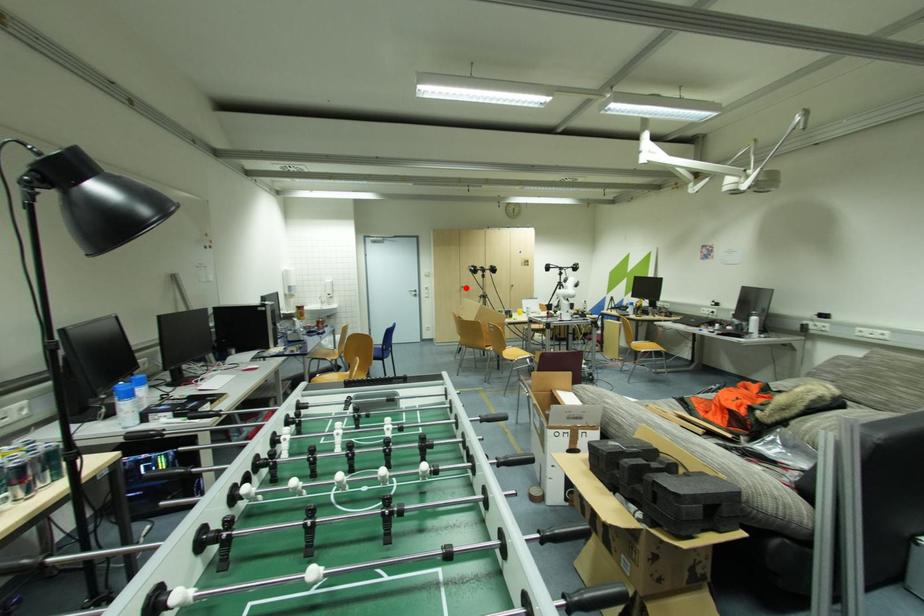
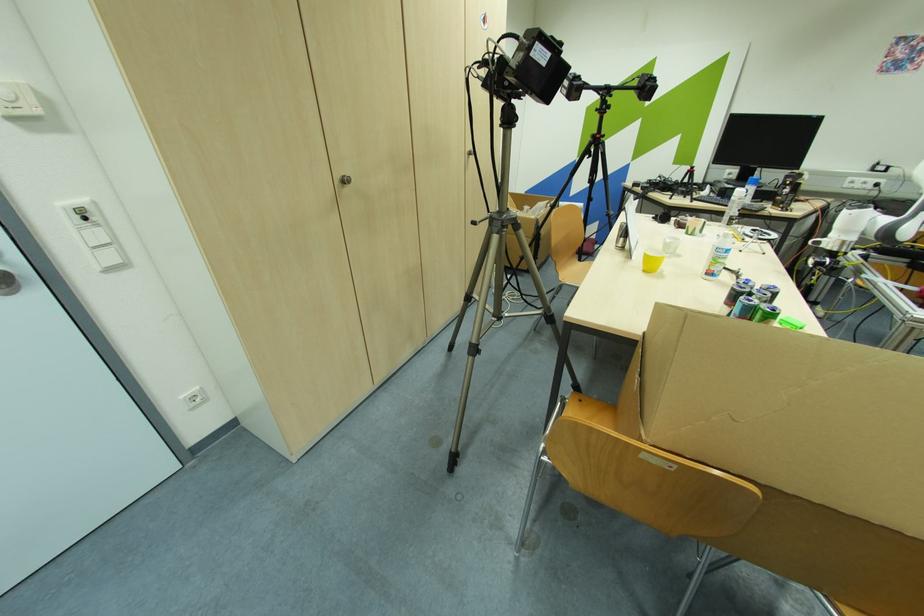
The point at the highlighted location is marked in the first image. Where is the corresponding point in the second image?

(348, 182)